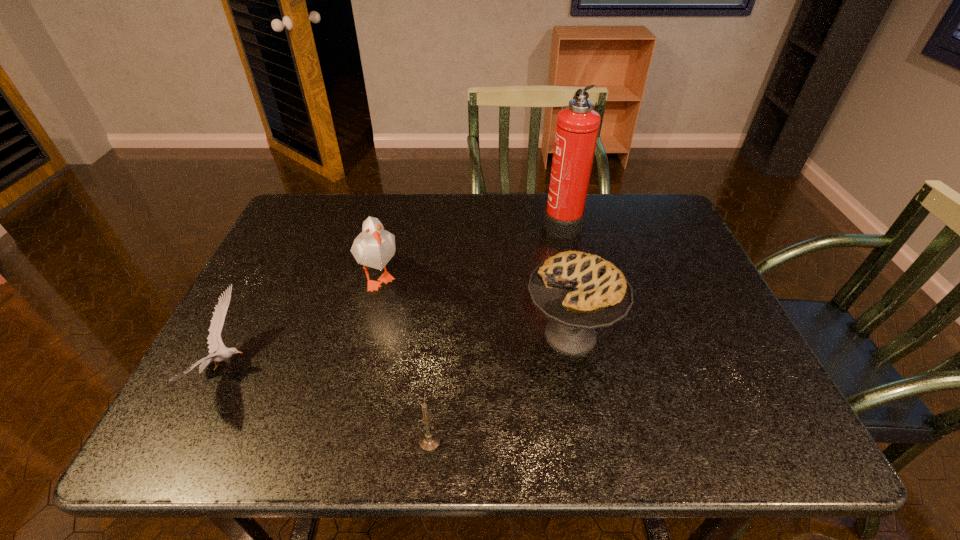
Identify the location of the farthest object. This screenshot has height=540, width=960. (577, 128).

Identify the location of fire extinguisher. (577, 128).

Where is `the second object from left to right`? the second object from left to right is located at coordinates (374, 247).

You are a GUI agent. You are given a task and a screenshot of the screen. Output one action in this format:
    pyautogui.click(x=<x>, y=<y>)
    Task: Click on the farther gull
    The image size is (960, 540).
    Given the screenshot: What is the action you would take?
    374,247

Locate an element on the screen. The image size is (960, 540). pie is located at coordinates (578, 292).

This screenshot has height=540, width=960. In order to click on the shorter gull in this screenshot , I will do `click(214, 339)`.

In order to click on the nearer gull in this screenshot , I will do `click(214, 339)`.

The height and width of the screenshot is (540, 960). In order to click on the nearest object in this screenshot , I will do `click(429, 441)`.

The image size is (960, 540). Find the location of `candle`. candle is located at coordinates (429, 441).

Find the location of a particular element. vacant space located 0.200m on the front-facing side of the fire extinguisher is located at coordinates (475, 222).